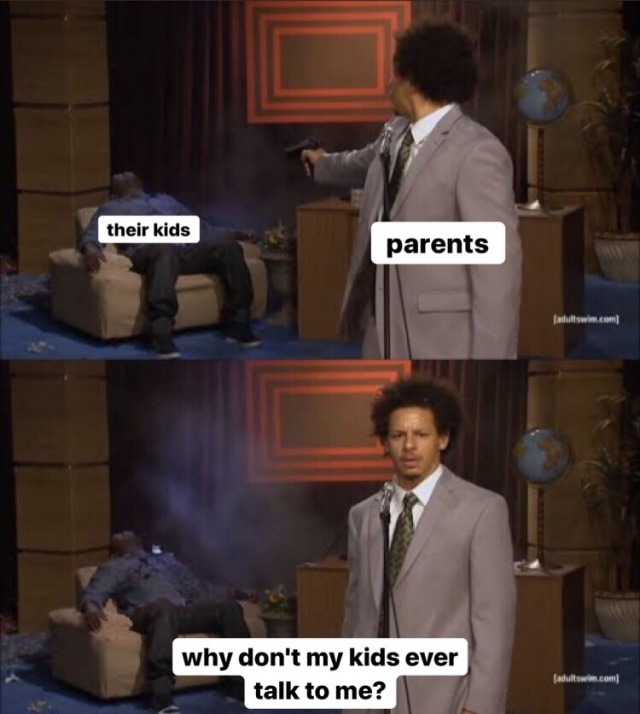
At what (x,y) coordinates should I click in order to perform the action: click on carpet. Please return your answer as a coordinate pair (x, y). Looking at the image, I should click on (65, 695), (614, 652).